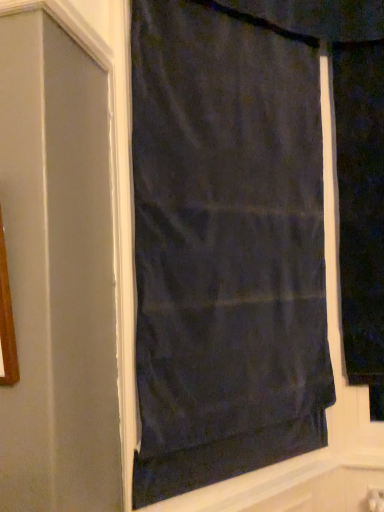
Question: Is black fabric curtain at right, which is counted as the 1th curtain, starting from the right, to the right of dark matte fabric curtain at center, the 1th curtain positioned from the left, from the viewer's perspective?

Choices:
 (A) yes
 (B) no

Answer: (A)

Question: Does black fabric curtain at right, which is counted as the 1th curtain, starting from the right, come in front of dark matte fabric curtain at center, the 1th curtain positioned from the left?

Choices:
 (A) yes
 (B) no

Answer: (B)

Question: From a real-world perspective, does black fabric curtain at right, which is counted as the 1th curtain, starting from the right, sit lower than dark matte fabric curtain at center, the 1th curtain positioned from the left?

Choices:
 (A) yes
 (B) no

Answer: (B)

Question: Can you confirm if black fabric curtain at right, which is the second curtain in left-to-right order, is shorter than dark matte fabric curtain at center, the 1th curtain positioned from the left?

Choices:
 (A) yes
 (B) no

Answer: (A)

Question: Is black fabric curtain at right, which is the second curtain in left-to-right order, positioned with its back to dark matte fabric curtain at center, the 1th curtain positioned from the left?

Choices:
 (A) no
 (B) yes

Answer: (A)

Question: Is black fabric curtain at right, which is the second curtain in left-to-right order, thinner than dark matte fabric curtain at center, the 2th curtain from the right?

Choices:
 (A) yes
 (B) no

Answer: (B)

Question: Is dark matte fabric curtain at center, the 1th curtain positioned from the left, positioned with its back to black fabric curtain at right, which is the second curtain in left-to-right order?

Choices:
 (A) yes
 (B) no

Answer: (B)

Question: Is dark matte fabric curtain at center, the 2th curtain from the right, at the right side of black fabric curtain at right, which is counted as the 1th curtain, starting from the right?

Choices:
 (A) no
 (B) yes

Answer: (A)

Question: Does dark matte fabric curtain at center, the 1th curtain positioned from the left, appear on the left side of black fabric curtain at right, which is the second curtain in left-to-right order?

Choices:
 (A) yes
 (B) no

Answer: (A)

Question: Does dark matte fabric curtain at center, the 1th curtain positioned from the left, have a smaller size compared to black fabric curtain at right, which is the second curtain in left-to-right order?

Choices:
 (A) yes
 (B) no

Answer: (B)

Question: Is dark matte fabric curtain at center, the 1th curtain positioned from the left, closer to camera compared to black fabric curtain at right, which is the second curtain in left-to-right order?

Choices:
 (A) no
 (B) yes

Answer: (B)

Question: Is dark matte fabric curtain at center, the 1th curtain positioned from the left, far away from black fabric curtain at right, which is counted as the 1th curtain, starting from the right?

Choices:
 (A) no
 (B) yes

Answer: (A)

Question: From the image's perspective, is black fabric curtain at right, which is counted as the 1th curtain, starting from the right, positioned above or below dark matte fabric curtain at center, the 2th curtain from the right?

Choices:
 (A) above
 (B) below

Answer: (A)